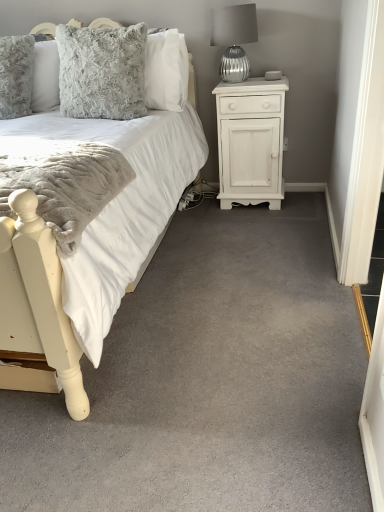
Question: Is silver textured glass at upper right beside white soft carpet at center?

Choices:
 (A) no
 (B) yes

Answer: (A)

Question: Is silver textured glass at upper right located outside white soft carpet at center?

Choices:
 (A) no
 (B) yes

Answer: (B)

Question: Is white soft carpet at center completely or partially inside silver textured glass at upper right?

Choices:
 (A) yes
 (B) no

Answer: (B)

Question: Is the position of silver textured glass at upper right more distant than that of white soft carpet at center?

Choices:
 (A) yes
 (B) no

Answer: (A)

Question: Could you tell me if silver textured glass at upper right is facing white soft carpet at center?

Choices:
 (A) yes
 (B) no

Answer: (B)

Question: From the image's perspective, is silver textured glass at upper right under white soft carpet at center?

Choices:
 (A) no
 (B) yes

Answer: (A)

Question: Are white soft carpet at center and white painted wood nightstand at right making contact?

Choices:
 (A) no
 (B) yes

Answer: (A)

Question: Can you confirm if white soft carpet at center is bigger than white painted wood nightstand at right?

Choices:
 (A) no
 (B) yes

Answer: (A)

Question: From a real-world perspective, is white soft carpet at center on white painted wood nightstand at right?

Choices:
 (A) no
 (B) yes

Answer: (A)

Question: Is white soft carpet at center shorter than white painted wood nightstand at right?

Choices:
 (A) no
 (B) yes

Answer: (B)

Question: Would you say white painted wood nightstand at right is part of white soft carpet at center's contents?

Choices:
 (A) no
 (B) yes

Answer: (A)

Question: Is white soft carpet at center at the left side of white painted wood nightstand at right?

Choices:
 (A) no
 (B) yes

Answer: (B)

Question: Is silver textured glass at upper right oriented away from fluffy gray pillow at upper left?

Choices:
 (A) no
 (B) yes

Answer: (A)